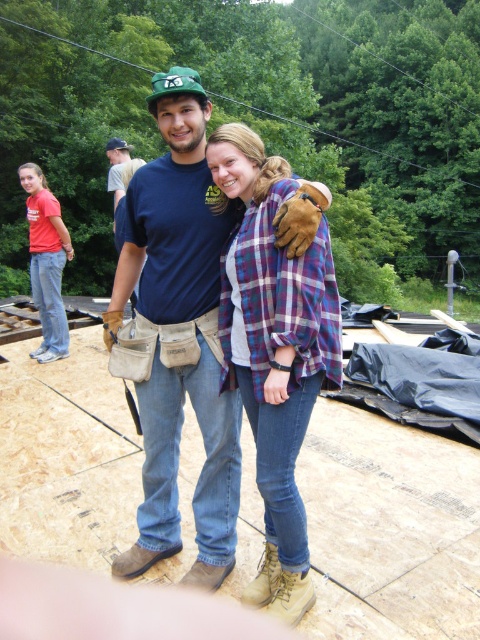
Where is `plaid fabric shirt at center`? plaid fabric shirt at center is located at coordinates (275, 353).

The width and height of the screenshot is (480, 640). What do you see at coordinates (275, 353) in the screenshot?
I see `plaid fabric shirt at center` at bounding box center [275, 353].

Is point (272, 170) behind point (122, 145)?

No, (272, 170) is in front of (122, 145).

I want to click on plaid fabric shirt at center, so click(x=275, y=353).

Does matte red t-shirt at left come behind blue fabric shirt at center?

Yes.

In order to click on matte red t-shirt at left in this screenshot , I will do `click(47, 260)`.

Looking at this image, who is more distant from viewer, (x=227, y=406) or (x=116, y=148)?

Positioned behind is point (x=116, y=148).

Is brown leather boots at center bigger than blue fabric shirt at center?

No, brown leather boots at center is not bigger than blue fabric shirt at center.

The image size is (480, 640). Identify the location of brown leather boots at center. (178, 337).

Locate an element on the screen. The width and height of the screenshot is (480, 640). brown leather boots at center is located at coordinates (178, 337).